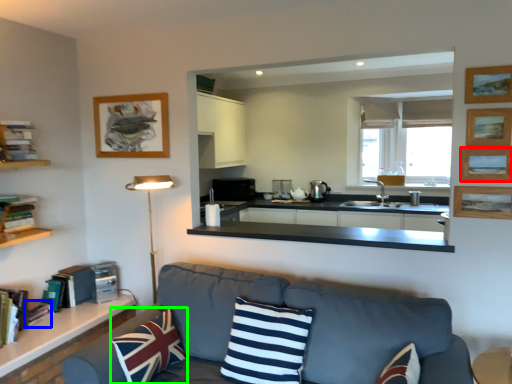
Question: Which object is positioned farthest from picture frame (highlighted by a red box)? Select from book (highlighted by a blue box) and pillow (highlighted by a green box).

Choices:
 (A) book
 (B) pillow

Answer: (A)